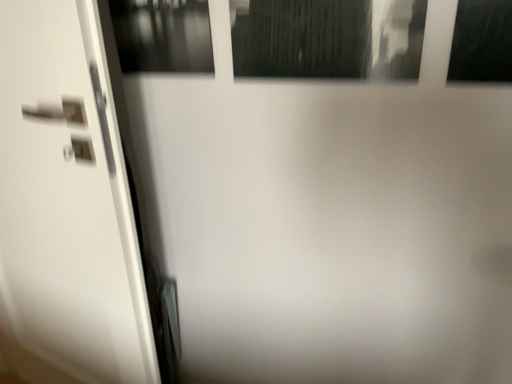
Question: Is white glossy door handle at left bigger than transparent glass window at upper left?

Choices:
 (A) no
 (B) yes

Answer: (B)

Question: Considering the relative sizes of white glossy door handle at left and transparent glass window at upper left in the image provided, is white glossy door handle at left shorter than transparent glass window at upper left?

Choices:
 (A) no
 (B) yes

Answer: (A)

Question: Considering the relative sizes of white glossy door handle at left and transparent glass window at upper left in the image provided, is white glossy door handle at left wider than transparent glass window at upper left?

Choices:
 (A) yes
 (B) no

Answer: (A)

Question: Is white glossy door handle at left thinner than transparent glass window at upper left?

Choices:
 (A) no
 (B) yes

Answer: (A)

Question: From the image's perspective, would you say white glossy door handle at left is positioned over transparent glass window at upper left?

Choices:
 (A) no
 (B) yes

Answer: (A)

Question: From the image's perspective, is white glossy door handle at left beneath transparent glass window at upper left?

Choices:
 (A) yes
 (B) no

Answer: (A)

Question: From a real-world perspective, is transparent glass window at upper left located beneath white glossy door handle at left?

Choices:
 (A) yes
 (B) no

Answer: (B)

Question: Is transparent glass window at upper left taller than white glossy door handle at left?

Choices:
 (A) no
 (B) yes

Answer: (A)

Question: Does transparent glass window at upper left lie behind white glossy door handle at left?

Choices:
 (A) yes
 (B) no

Answer: (A)

Question: Are transparent glass window at upper left and white glossy door handle at left making contact?

Choices:
 (A) yes
 (B) no

Answer: (B)

Question: Is there a large distance between transparent glass window at upper left and white glossy door handle at left?

Choices:
 (A) yes
 (B) no

Answer: (B)

Question: Can you confirm if transparent glass window at upper left is positioned to the left of white glossy door handle at left?

Choices:
 (A) no
 (B) yes

Answer: (A)

Question: Does point (135, 44) appear closer or farther from the camera than point (15, 145)?

Choices:
 (A) closer
 (B) farther

Answer: (A)